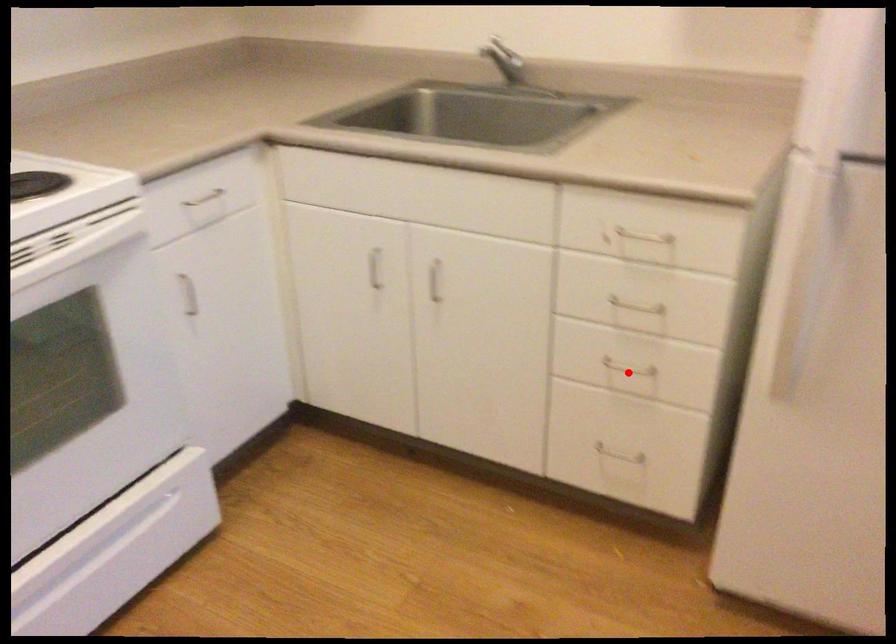
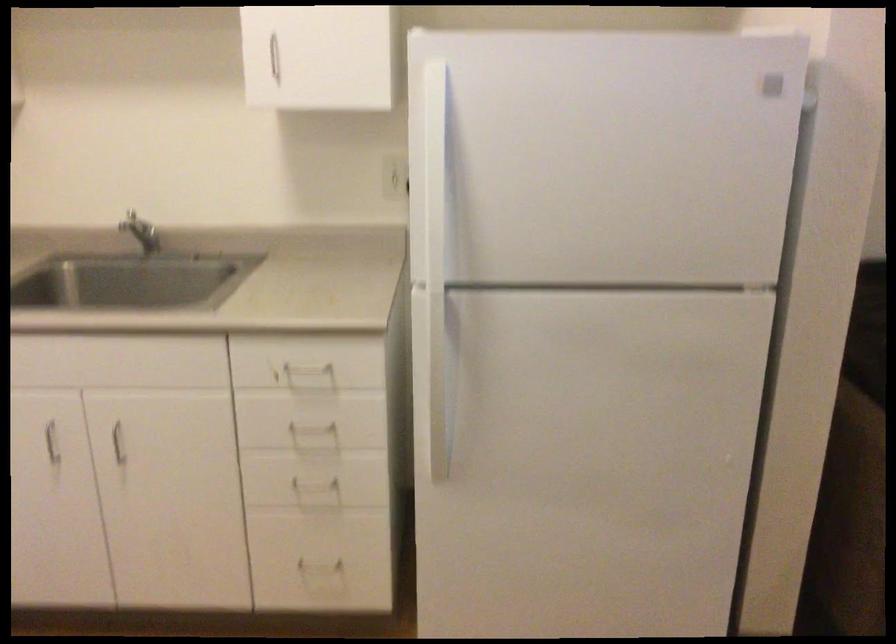
Question: I am providing you with two images of the same scene from different viewpoints. Image1 has a red point marked. In image2, the corresponding 3D location appears at what relative position? Reply with the corresponding letter.

Choices:
 (A) Closer
 (B) Farther

Answer: (B)